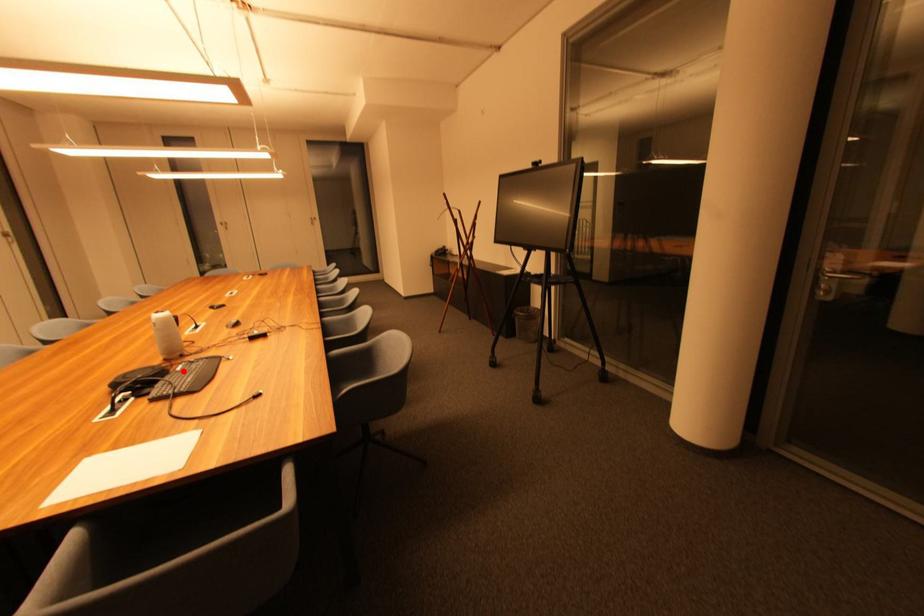
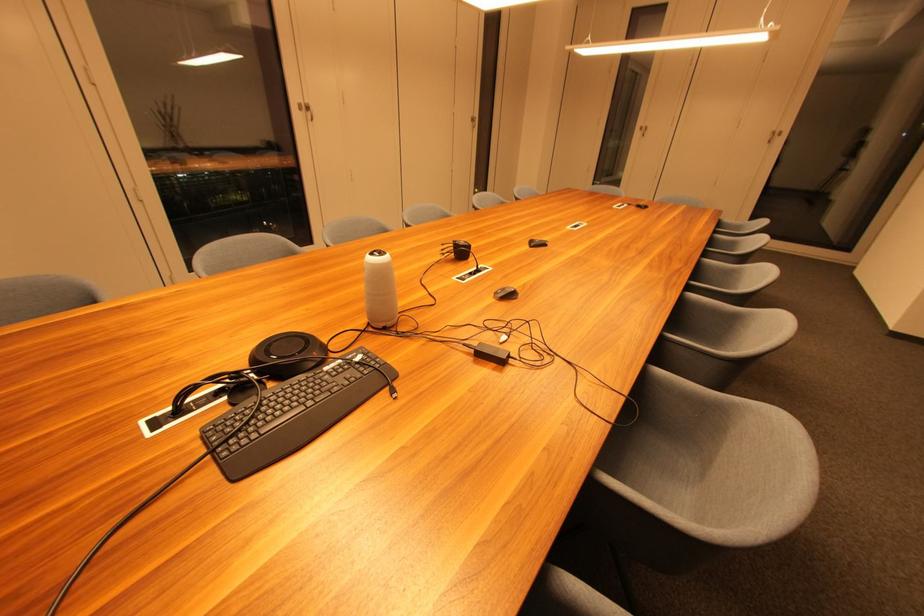
In the second image, find the point that corresponds to the highlighted location in the first image.

(332, 371)